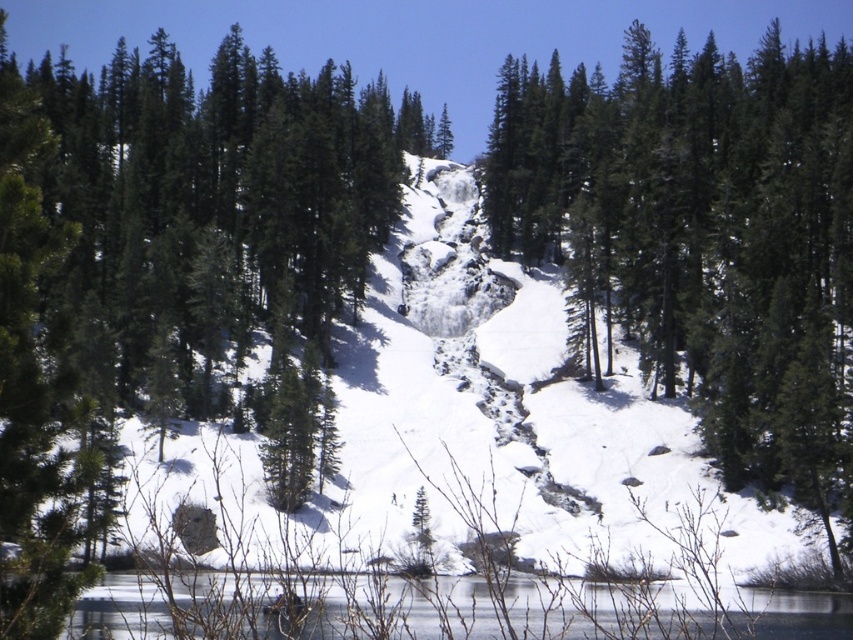
Question: Which object is farther from the camera taking this photo?

Choices:
 (A) green matte tree at center
 (B) clear ice lake at lower center

Answer: (A)

Question: Is green matte tree at center to the right of clear ice lake at lower center from the viewer's perspective?

Choices:
 (A) no
 (B) yes

Answer: (B)

Question: Where is green matte tree at center located in relation to clear ice lake at lower center in the image?

Choices:
 (A) above
 (B) below

Answer: (A)

Question: Which point is closer to the camera?

Choices:
 (A) (524, 108)
 (B) (137, 636)

Answer: (B)

Question: Is green matte tree at center further to the viewer compared to clear ice lake at lower center?

Choices:
 (A) yes
 (B) no

Answer: (A)

Question: Which object is closer to the camera taking this photo?

Choices:
 (A) clear ice lake at lower center
 (B) green matte tree at center

Answer: (A)